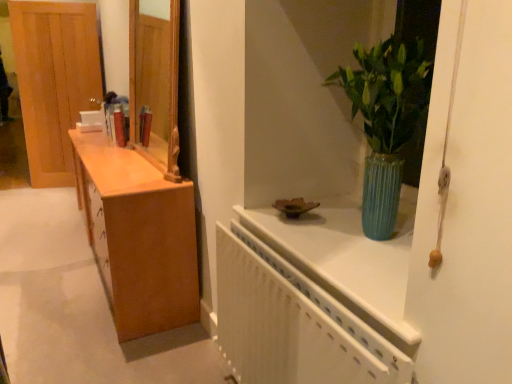
Question: From the image's perspective, is green ribbed vase at upper right on top of white textured radiator at upper right?

Choices:
 (A) no
 (B) yes

Answer: (B)

Question: Considering the relative positions of green ribbed vase at upper right and white textured radiator at upper right in the image provided, is green ribbed vase at upper right to the left of white textured radiator at upper right from the viewer's perspective?

Choices:
 (A) no
 (B) yes

Answer: (A)

Question: Is green ribbed vase at upper right facing away from white textured radiator at upper right?

Choices:
 (A) no
 (B) yes

Answer: (A)

Question: Is green ribbed vase at upper right aimed at white textured radiator at upper right?

Choices:
 (A) yes
 (B) no

Answer: (B)

Question: Considering the relative sizes of green ribbed vase at upper right and white textured radiator at upper right in the image provided, is green ribbed vase at upper right taller than white textured radiator at upper right?

Choices:
 (A) no
 (B) yes

Answer: (A)

Question: Is green ribbed vase at upper right further to the viewer compared to white textured radiator at upper right?

Choices:
 (A) no
 (B) yes

Answer: (B)

Question: From the image's perspective, does light brown wood door at left appear lower than white textured radiator at upper right?

Choices:
 (A) no
 (B) yes

Answer: (A)

Question: Considering the relative sizes of light brown wood door at left and white textured radiator at upper right in the image provided, is light brown wood door at left bigger than white textured radiator at upper right?

Choices:
 (A) yes
 (B) no

Answer: (A)

Question: Is light brown wood door at left looking in the opposite direction of white textured radiator at upper right?

Choices:
 (A) no
 (B) yes

Answer: (A)

Question: Does light brown wood door at left have a lesser width compared to white textured radiator at upper right?

Choices:
 (A) yes
 (B) no

Answer: (A)

Question: Can you confirm if light brown wood door at left is smaller than white textured radiator at upper right?

Choices:
 (A) no
 (B) yes

Answer: (A)

Question: From a real-world perspective, does light brown wood door at left sit lower than white textured radiator at upper right?

Choices:
 (A) no
 (B) yes

Answer: (A)

Question: Can you confirm if white textured radiator at upper right is thinner than light brown wood door at left?

Choices:
 (A) no
 (B) yes

Answer: (A)